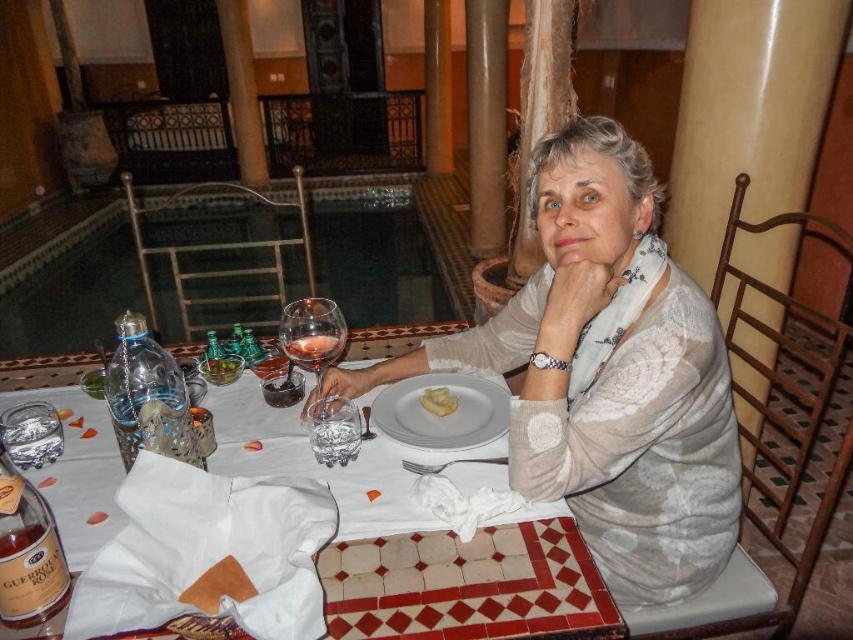
Can you confirm if clear glass wine at table center is thinner than green leafy vegetables at center?

No.

Is clear glass wine at table center to the left of green leafy vegetables at center from the viewer's perspective?

Incorrect, clear glass wine at table center is not on the left side of green leafy vegetables at center.

Between point (306, 360) and point (234, 362), which one is positioned in front?

Positioned in front is point (306, 360).

Locate an element on the screen. This screenshot has height=640, width=853. clear glass wine at table center is located at coordinates (312, 349).

Who is taller, white lace shirt at center or transparent glass pool at center?

Standing taller between the two is transparent glass pool at center.

Who is more forward, (735, 476) or (415, 208)?

Point (735, 476) is in front.

This screenshot has width=853, height=640. What are the coordinates of `white lace shirt at center` in the screenshot? It's located at (607, 372).

Is transparent glass pool at center closer to the viewer compared to clear glass at table center?

No, it is not.

What do you see at coordinates (71, 284) in the screenshot?
I see `transparent glass pool at center` at bounding box center [71, 284].

Is point (450, 300) more distant than point (340, 452)?

Yes, point (450, 300) is farther from viewer.

Image resolution: width=853 pixels, height=640 pixels. What are the coordinates of `transparent glass pool at center` in the screenshot? It's located at (71, 284).